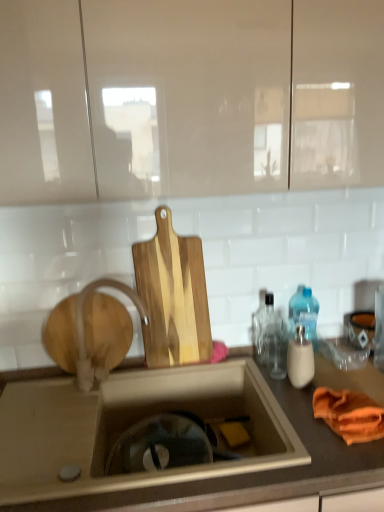
Locate an element on the screen. The width and height of the screenshot is (384, 512). vacant space situated on the left part of orange cloth at right is located at coordinates (291, 426).